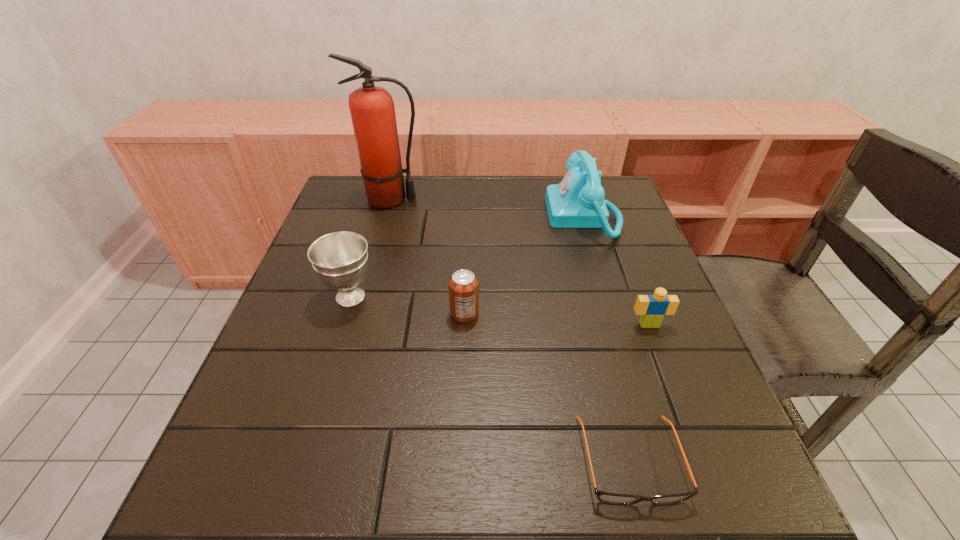
Locate an element on the screen. Lego present at the right edge is located at coordinates (652, 308).

Find the location of a particular element. The height and width of the screenshot is (540, 960). spectacles positioned at the right edge is located at coordinates (612, 498).

Locate an element on the screen. object located at the far left corner is located at coordinates (372, 110).

You are a GUI agent. You are given a task and a screenshot of the screen. Output one action in this format:
    pyautogui.click(x=<x>, y=<y>)
    Task: Click on the object situated at the far right corner
    
    Given the screenshot: What is the action you would take?
    pyautogui.click(x=577, y=201)

You are a GUI agent. You are given a task and a screenshot of the screen. Output one action in this format:
    pyautogui.click(x=<x>, y=<y>)
    Task: Click on the object that is at the near right corner
    This screenshot has height=540, width=960.
    Given the screenshot: What is the action you would take?
    pyautogui.click(x=612, y=498)

What are the coordinates of `vacant region at the far edge of the desktop` in the screenshot? It's located at (541, 218).

This screenshot has width=960, height=540. I want to click on vacant area at the near edge, so coord(459,491).

In the image, there is a desktop. Where is `free space at the left edge`? Image resolution: width=960 pixels, height=540 pixels. free space at the left edge is located at coordinates (336, 309).

Find the location of a particular element. The width and height of the screenshot is (960, 540). vacant space at the right edge of the desktop is located at coordinates (633, 256).

In the image, there is a desktop. Identify the location of vacant space at the far left corner. (334, 213).